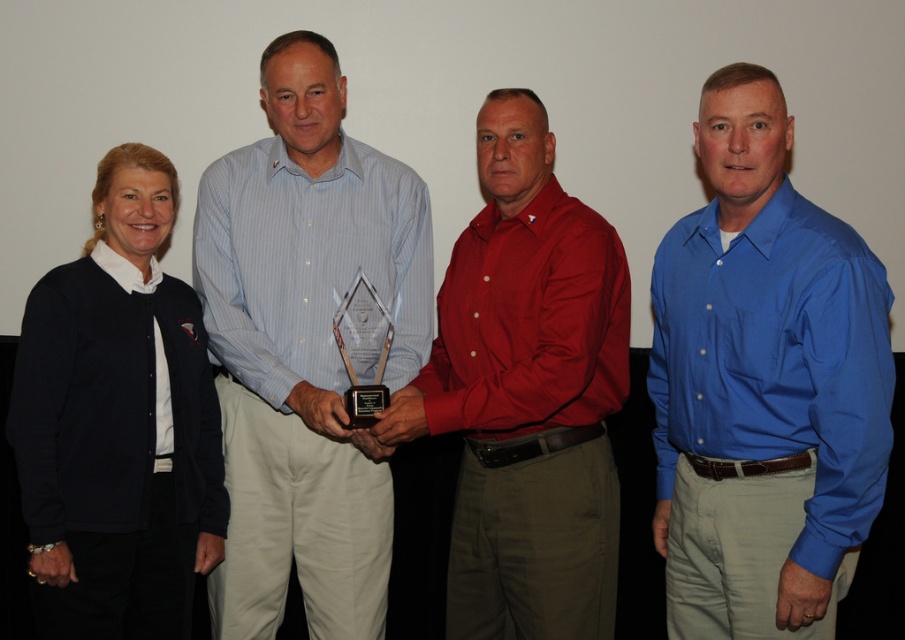
You are organizing a photo shoot and need to arrange the blue smooth shirt at right and the blue striped shirt at center based on their sizes. Which shirt should be placed to the left to maintain proper size order from smallest to largest?

The blue smooth shirt at right is smaller than the blue striped shirt at center, so to maintain proper size order from smallest to largest, the blue smooth shirt at right should be placed to the left of the blue striped shirt at center.

Based on the scene description, which individual is shorter between the blue smooth shirt at right and the shiny red shirt at center?

The blue smooth shirt at right is not as tall as the shiny red shirt at center, so the blue smooth shirt at right is shorter.

You are standing in front of the group photo and want to know the distance between the shiny red shirt at center and the navy blue sweater at left. Can you estimate how far apart they are?

The shiny red shirt at center is 27.69 inches from the navy blue sweater at left.